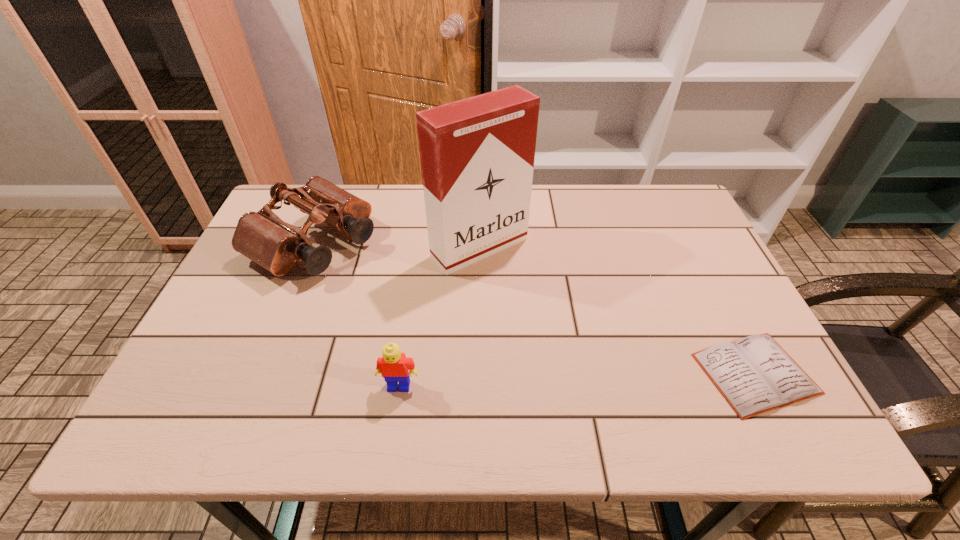
Locate an element on the screen. vacant region between the third shortest object and the diary is located at coordinates (535, 308).

I want to click on vacant area that lies between the Lego and the leftmost object, so (x=357, y=314).

In order to click on vacant area between the second tallest object and the second shortest object in this screenshot , I will do `click(357, 314)`.

Where is `unoccupied area between the binoculars and the rightmost object`? unoccupied area between the binoculars and the rightmost object is located at coordinates (535, 308).

Identify the location of empty space between the diary and the leftmost object. (535, 308).

Where is `blank region between the leftmost object and the shortest object`? blank region between the leftmost object and the shortest object is located at coordinates (535, 308).

Identify which object is the third nearest to the tallest object. Please provide its 2D coordinates. Your answer should be formatted as a tuple, i.e. [(x, y)], where the tuple contains the x and y coordinates of a point satisfying the conditions above.

[(755, 374)]

You are a GUI agent. You are given a task and a screenshot of the screen. Output one action in this format:
    pyautogui.click(x=<x>, y=<y>)
    Task: Click on the object that can be found as the third closest to the Lego
    The width and height of the screenshot is (960, 540).
    Given the screenshot: What is the action you would take?
    pyautogui.click(x=755, y=374)